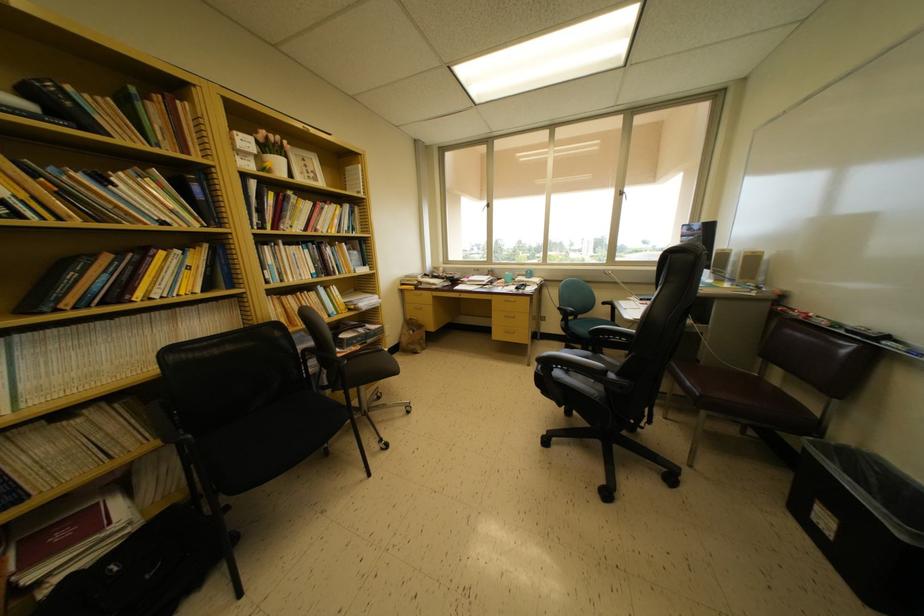
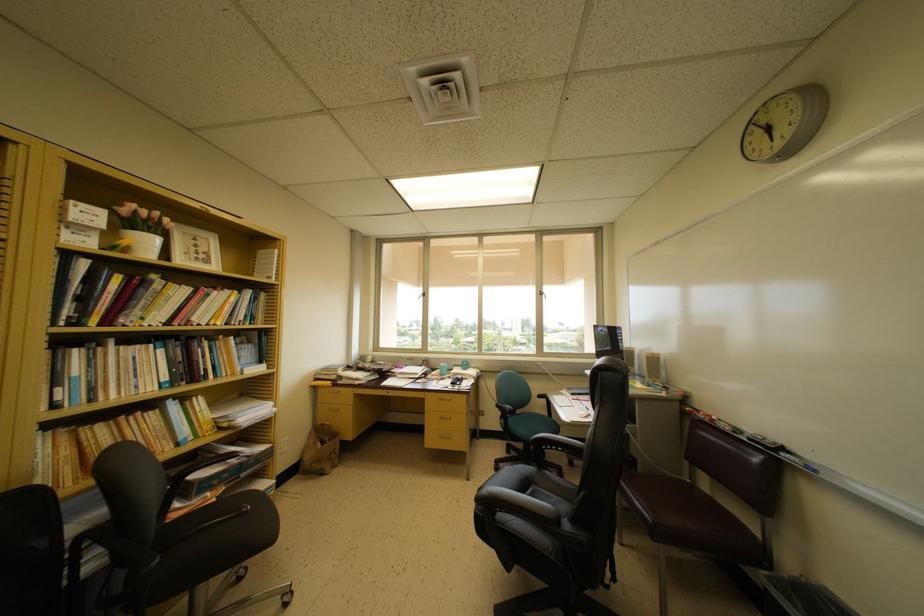
In the second image, find the point that corresponds to [516,298] in the first image.

(451, 394)